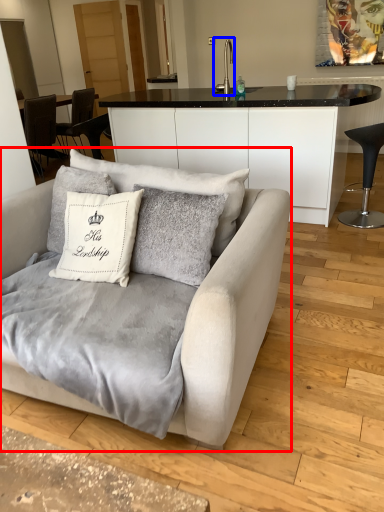
Question: Which object is further to the camera taking this photo, studio couch (highlighted by a red box) or silver (highlighted by a blue box)?

Choices:
 (A) studio couch
 (B) silver

Answer: (B)